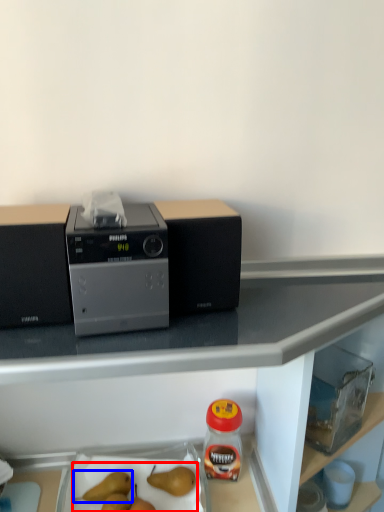
Question: Which object is further to the camera taking this photo, fruit (highlighted by a red box) or fruit (highlighted by a blue box)?

Choices:
 (A) fruit
 (B) fruit

Answer: (B)